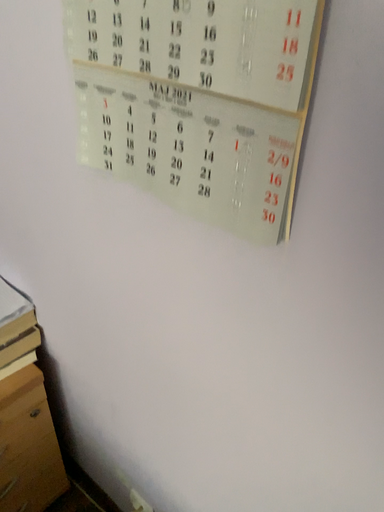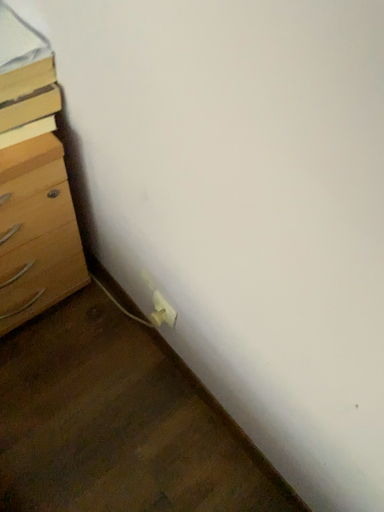
Question: Which way did the camera rotate in the video?

Choices:
 (A) rotated upward
 (B) rotated downward

Answer: (B)